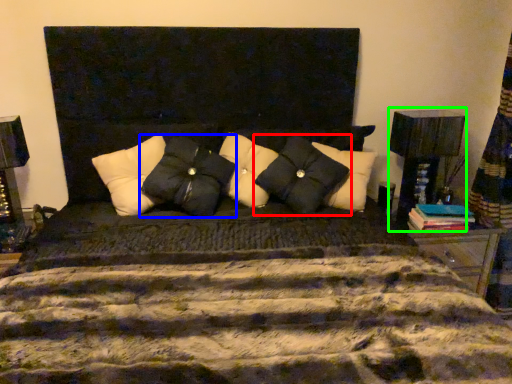
Question: Which is farther away from pillow (highlighted by a red box)? pillow (highlighted by a blue box) or table lamp (highlighted by a green box)?

Choices:
 (A) pillow
 (B) table lamp

Answer: (B)